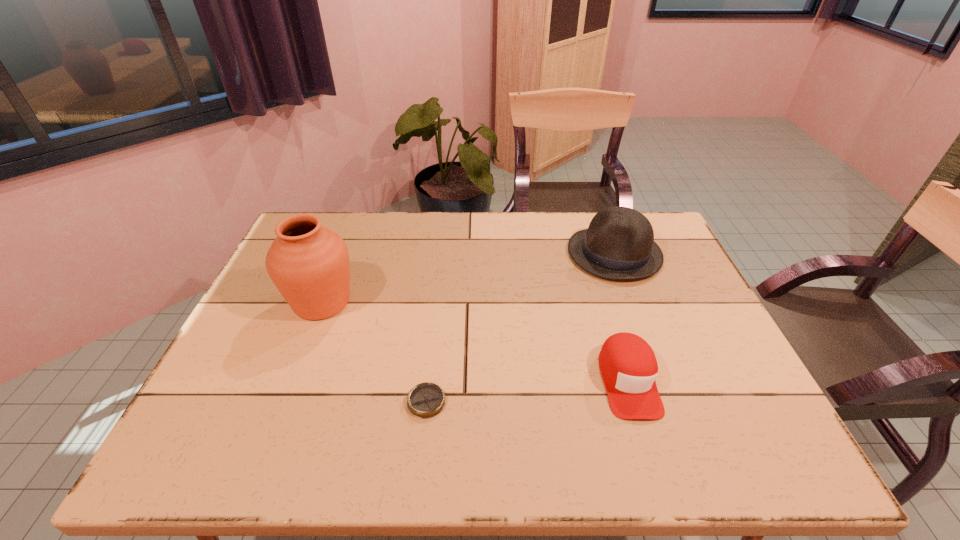
The image size is (960, 540). What are the coordinates of `urn` in the screenshot? It's located at (309, 264).

You are a GUI agent. You are given a task and a screenshot of the screen. Output one action in this format:
    pyautogui.click(x=<x>, y=<y>)
    Task: Click on the tallest object
    This screenshot has width=960, height=540.
    Given the screenshot: What is the action you would take?
    pyautogui.click(x=309, y=264)

The width and height of the screenshot is (960, 540). Identify the location of the third shortest object. (619, 244).

The image size is (960, 540). I want to click on the third tallest object, so click(x=628, y=366).

Find the location of `the second object from left to right`. the second object from left to right is located at coordinates click(x=425, y=400).

Locate an element on the screen. The width and height of the screenshot is (960, 540). the shortest object is located at coordinates (425, 400).

Where is `blank space located on the right of the urn`? This screenshot has width=960, height=540. blank space located on the right of the urn is located at coordinates (397, 302).

At what (x,y) coordinates should I click in order to perform the action: click on blank area located 0.280m on the front-facing side of the second tallest object. Please return your answer as a coordinate pair (x, y). Looking at the image, I should click on 478,253.

The height and width of the screenshot is (540, 960). What are the coordinates of `free space located on the front-facing side of the second tallest object` in the screenshot? It's located at (523, 253).

This screenshot has width=960, height=540. Find the location of `free space located 0.350m on the front-facing side of the second tallest object`. free space located 0.350m on the front-facing side of the second tallest object is located at coordinates (456, 253).